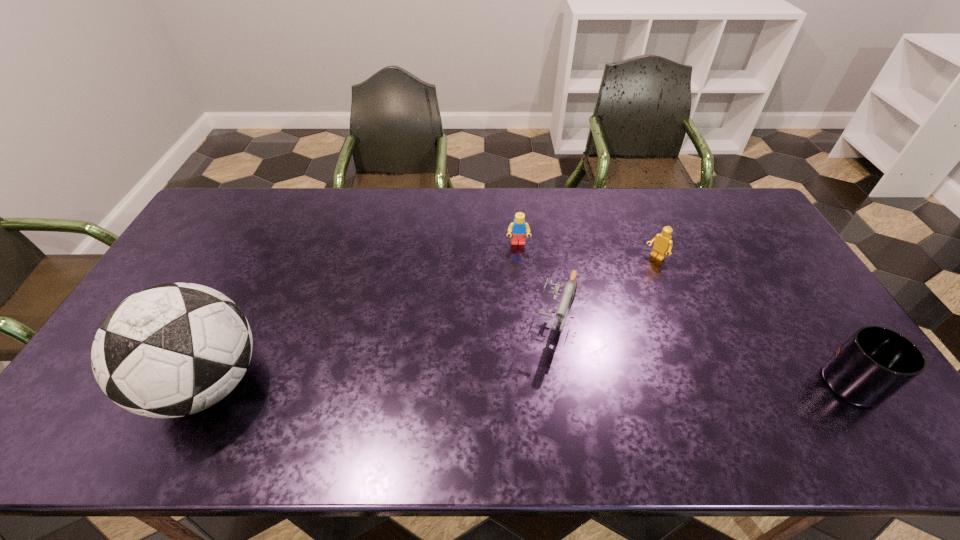
What are the coordinates of `vacant space at the far right corner of the desktop` in the screenshot? It's located at (715, 188).

At what (x,y) coordinates should I click in order to perform the action: click on free spot between the gun and the nearer Lego. Please return your answer as a coordinate pair (x, y). The image size is (960, 540). Looking at the image, I should click on (607, 289).

I want to click on empty space between the second object from right to left and the farther Lego, so click(587, 251).

Identify the location of vacant space that is in between the gun and the mug. (709, 352).

Locate an element on the screen. free space between the mug and the right Lego is located at coordinates (757, 321).

Where is `blank region between the fourth object from left to right and the leftmost object`? Image resolution: width=960 pixels, height=540 pixels. blank region between the fourth object from left to right and the leftmost object is located at coordinates (431, 321).

Find the location of a particular element. This screenshot has width=960, height=540. free spot between the tallest object and the left Lego is located at coordinates (363, 314).

Where is `vacant region between the gun and the rightmost object`? vacant region between the gun and the rightmost object is located at coordinates (709, 352).

At what (x,y) coordinates should I click in order to perform the action: click on free space between the second farthest object and the rightmost object. Please return your answer as a coordinate pair (x, y). This screenshot has height=540, width=960. Looking at the image, I should click on (757, 321).

The height and width of the screenshot is (540, 960). I want to click on vacant space that's between the right Lego and the farther Lego, so 587,251.